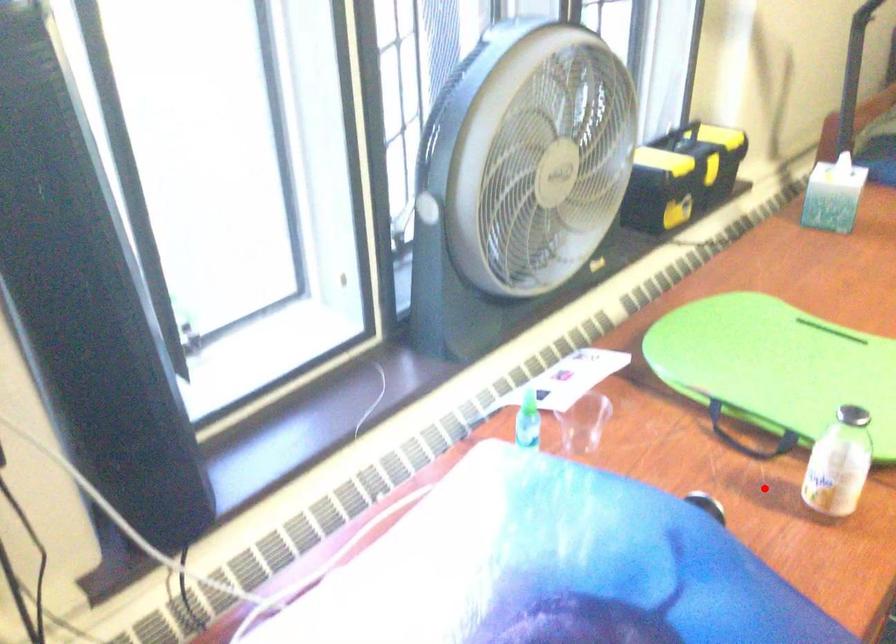
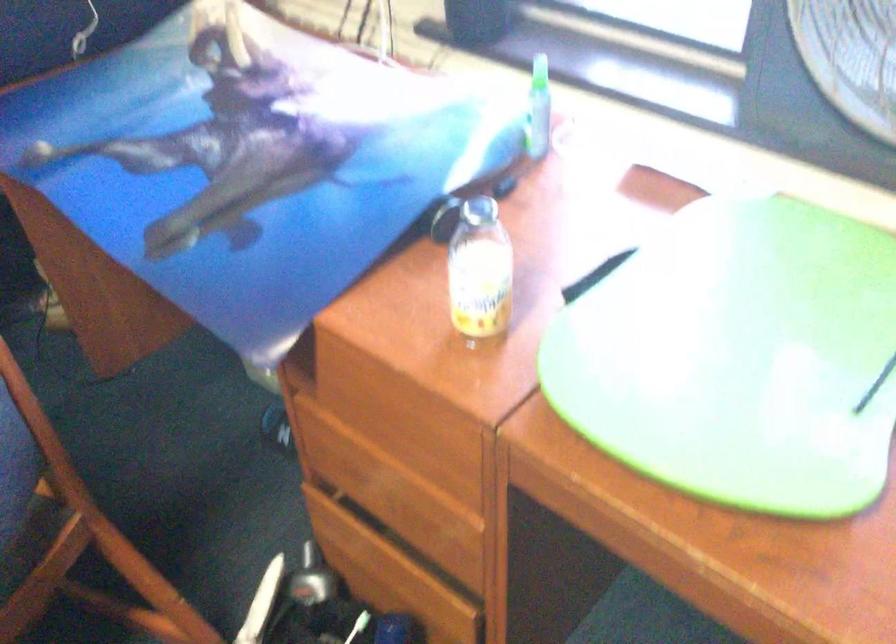
Locate, in the second image, the point that corresponds to the highlighted location in the first image.

(479, 270)